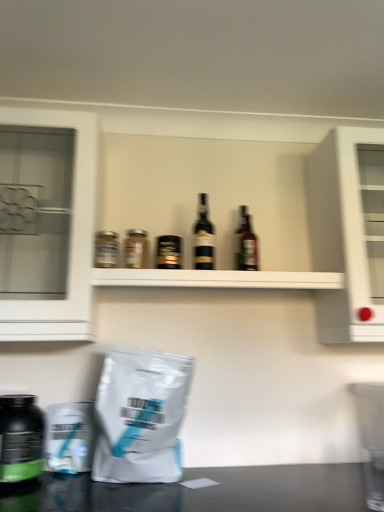
Where is `white glossy cabinet at upper right, which is the first cabinetry in right-to-left order`? This screenshot has height=512, width=384. white glossy cabinet at upper right, which is the first cabinetry in right-to-left order is located at coordinates (348, 232).

What do you see at coordinates (203, 238) in the screenshot? I see `black glass bottle at center, acting as the 5th bottle starting from the left` at bounding box center [203, 238].

In order to click on white matte grocery bag at lower left in this screenshot , I will do `click(141, 416)`.

From the image's perspective, is green matte bottle at lower left, positioned as the first bottle in left-to-right order, below metallic silver jar at upper left, positioned as the second bottle in left-to-right order?

Yes, from the image's perspective, green matte bottle at lower left, positioned as the first bottle in left-to-right order, is beneath metallic silver jar at upper left, positioned as the second bottle in left-to-right order.

Is green matte bottle at lower left, which is counted as the 6th bottle, starting from the right, not near metallic silver jar at upper left, the fifth bottle when ordered from right to left?

No, green matte bottle at lower left, which is counted as the 6th bottle, starting from the right, is not far from metallic silver jar at upper left, the fifth bottle when ordered from right to left.

Which object is thinner, green matte bottle at lower left, which is counted as the 6th bottle, starting from the right, or metallic silver jar at upper left, the fifth bottle when ordered from right to left?

With smaller width is metallic silver jar at upper left, the fifth bottle when ordered from right to left.

From the picture: Is green matte bottle at lower left, positioned as the first bottle in left-to-right order, inside or outside of metallic silver jar at upper left, positioned as the second bottle in left-to-right order?

green matte bottle at lower left, positioned as the first bottle in left-to-right order, is located beyond the bounds of metallic silver jar at upper left, positioned as the second bottle in left-to-right order.

Is white glossy shelf at center wider or thinner than white glass cabinet at left, which appears as the first cabinetry when viewed from the left?

white glossy shelf at center is thinner than white glass cabinet at left, which appears as the first cabinetry when viewed from the left.

Based on the photo, is white glossy shelf at center aimed at white glass cabinet at left, which is counted as the 2th cabinetry, starting from the right?

No, white glossy shelf at center is not oriented towards white glass cabinet at left, which is counted as the 2th cabinetry, starting from the right.

Is white glossy shelf at center at the right side of white glass cabinet at left, which is counted as the 2th cabinetry, starting from the right?

Indeed, white glossy shelf at center is positioned on the right side of white glass cabinet at left, which is counted as the 2th cabinetry, starting from the right.

From the image's perspective, is white glass cabinet at left, which appears as the first cabinetry when viewed from the left, on top of green matte bottle at lower left, positioned as the first bottle in left-to-right order?

Yes, from the image's perspective, white glass cabinet at left, which appears as the first cabinetry when viewed from the left, is above green matte bottle at lower left, positioned as the first bottle in left-to-right order.

Is white glass cabinet at left, which is counted as the 2th cabinetry, starting from the right, wider or thinner than green matte bottle at lower left, which is counted as the 6th bottle, starting from the right?

Considering their sizes, white glass cabinet at left, which is counted as the 2th cabinetry, starting from the right, looks broader than green matte bottle at lower left, which is counted as the 6th bottle, starting from the right.

From a real-world perspective, which object stands above the other?

white glass cabinet at left, which is counted as the 2th cabinetry, starting from the right, from a real-world perspective.

Visually, is white glass cabinet at left, which is counted as the 2th cabinetry, starting from the right, positioned to the left or to the right of green matte bottle at lower left, which is counted as the 6th bottle, starting from the right?

From the image, it's evident that white glass cabinet at left, which is counted as the 2th cabinetry, starting from the right, is to the right of green matte bottle at lower left, which is counted as the 6th bottle, starting from the right.

How different are the orientations of black matte bottle at center, placed as the third bottle when sorted from right to left, and green matte bottle at lower left, positioned as the first bottle in left-to-right order, in degrees?

There is a 0.284-degree angle between the facing directions of black matte bottle at center, placed as the third bottle when sorted from right to left, and green matte bottle at lower left, positioned as the first bottle in left-to-right order.

Based on the photo, would you say black matte bottle at center, placed as the third bottle when sorted from right to left, is to the left or to the right of green matte bottle at lower left, positioned as the first bottle in left-to-right order, in the picture?

black matte bottle at center, placed as the third bottle when sorted from right to left, is positioned on green matte bottle at lower left, positioned as the first bottle in left-to-right order,'s right side.

Is black matte bottle at center, placed as the third bottle when sorted from right to left, thinner than green matte bottle at lower left, positioned as the first bottle in left-to-right order?

Indeed, black matte bottle at center, placed as the third bottle when sorted from right to left, has a lesser width compared to green matte bottle at lower left, positioned as the first bottle in left-to-right order.

Is black matte bottle at center, which is counted as the 4th bottle, starting from the left, positioned far away from green matte bottle at lower left, positioned as the first bottle in left-to-right order?

Actually, black matte bottle at center, which is counted as the 4th bottle, starting from the left, and green matte bottle at lower left, positioned as the first bottle in left-to-right order, are a little close together.

Does point (127, 263) come closer to viewer compared to point (254, 245)?

Yes.

From a real-world perspective, is matte glass jar at center, which is the 3th bottle from left to right, above or below brown glass bottle at center, which appears as the 1th bottle when viewed from the right?

→ matte glass jar at center, which is the 3th bottle from left to right, is situated lower than brown glass bottle at center, which appears as the 1th bottle when viewed from the right, in the real world.

Is matte glass jar at center, which is the 3th bottle from left to right, shorter than brown glass bottle at center, which appears as the 1th bottle when viewed from the right?

Indeed, matte glass jar at center, which is the 3th bottle from left to right, has a lesser height compared to brown glass bottle at center, which appears as the 1th bottle when viewed from the right.

In terms of height, does metallic silver jar at upper left, positioned as the second bottle in left-to-right order, look taller or shorter compared to black matte bottle at center, which is counted as the 4th bottle, starting from the left?

Considering their sizes, metallic silver jar at upper left, positioned as the second bottle in left-to-right order, has less height than black matte bottle at center, which is counted as the 4th bottle, starting from the left.

Is point (116, 266) positioned after point (178, 237)?

No, (116, 266) is in front of (178, 237).

From a real-world perspective, which object rests below the other?

metallic silver jar at upper left, positioned as the second bottle in left-to-right order, is physically lower.

Is metallic silver jar at upper left, positioned as the second bottle in left-to-right order, in front of black matte bottle at center, placed as the third bottle when sorted from right to left?

That is True.

In the scene shown: Which object is positioned more to the left, white glossy cabinet at upper right, the second cabinetry when ordered from left to right, or green matte bottle at lower left, which is counted as the 6th bottle, starting from the right?

From the viewer's perspective, green matte bottle at lower left, which is counted as the 6th bottle, starting from the right, appears more on the left side.

From the image's perspective, count 4th bottles downward from the white glossy cabinet at upper right, which is the first cabinetry in right-to-left order, and point to it. Please provide its 2D coordinates.

[(20, 439)]

In terms of size, does white glossy cabinet at upper right, which is the first cabinetry in right-to-left order, appear bigger or smaller than green matte bottle at lower left, positioned as the first bottle in left-to-right order?

Clearly, white glossy cabinet at upper right, which is the first cabinetry in right-to-left order, is larger in size than green matte bottle at lower left, positioned as the first bottle in left-to-right order.

Is white glossy cabinet at upper right, which is the first cabinetry in right-to-left order, turned away from green matte bottle at lower left, which is counted as the 6th bottle, starting from the right?

No, green matte bottle at lower left, which is counted as the 6th bottle, starting from the right, is not at the back of white glossy cabinet at upper right, which is the first cabinetry in right-to-left order.

Where is `bottle that appears below the metallic silver jar at upper left, positioned as the second bottle in left-to-right order (from a real-world perspective)`? The width and height of the screenshot is (384, 512). bottle that appears below the metallic silver jar at upper left, positioned as the second bottle in left-to-right order (from a real-world perspective) is located at coordinates (20, 439).

The image size is (384, 512). Identify the location of cabinetry lying on the left of white glossy shelf at center. (70, 240).

Looking at the image, which one is located closer to white glass cabinet at left, which is counted as the 2th cabinetry, starting from the right, black matte bottle at center, which is counted as the 4th bottle, starting from the left, or matte glass jar at center, which is the fourth bottle in right-to-left order?

matte glass jar at center, which is the fourth bottle in right-to-left order, is positioned closer to the anchor white glass cabinet at left, which is counted as the 2th cabinetry, starting from the right.

Looking at the image, which one is located closer to black glass bottle at center, acting as the 5th bottle starting from the left, metallic silver jar at upper left, the fifth bottle when ordered from right to left, or white matte grocery bag at lower left?

metallic silver jar at upper left, the fifth bottle when ordered from right to left, lies closer to black glass bottle at center, acting as the 5th bottle starting from the left, than the other object.

Which object lies nearer to the anchor point white glossy cabinet at upper right, the second cabinetry when ordered from left to right, white glass cabinet at left, which is counted as the 2th cabinetry, starting from the right, or black matte bottle at center, which is counted as the 4th bottle, starting from the left?

black matte bottle at center, which is counted as the 4th bottle, starting from the left, is closer to white glossy cabinet at upper right, the second cabinetry when ordered from left to right.

Looking at the image, which one is located closer to white glossy shelf at center, white matte grocery bag at lower left or brown glass bottle at center, which appears as the 1th bottle when viewed from the right?

brown glass bottle at center, which appears as the 1th bottle when viewed from the right, lies closer to white glossy shelf at center than the other object.

Looking at the image, which one is located further to brown glass bottle at center, which appears as the 1th bottle when viewed from the right, green matte bottle at lower left, which is counted as the 6th bottle, starting from the right, or matte glass jar at center, which is the fourth bottle in right-to-left order?

green matte bottle at lower left, which is counted as the 6th bottle, starting from the right, is positioned further to the anchor brown glass bottle at center, which appears as the 1th bottle when viewed from the right.

In the scene shown: Based on their spatial positions, is black glass bottle at center, acting as the 5th bottle starting from the left, or green matte bottle at lower left, positioned as the first bottle in left-to-right order, further from white glass cabinet at left, which appears as the first cabinetry when viewed from the left?

black glass bottle at center, acting as the 5th bottle starting from the left, is positioned further to the anchor white glass cabinet at left, which appears as the first cabinetry when viewed from the left.

Estimate the real-world distances between objects in this image. Which object is closer to matte glass jar at center, which is the 3th bottle from left to right, black matte bottle at center, placed as the third bottle when sorted from right to left, or white glossy shelf at center?

black matte bottle at center, placed as the third bottle when sorted from right to left, lies closer to matte glass jar at center, which is the 3th bottle from left to right, than the other object.

From the image, which object appears to be farther from brown glass bottle at center, which appears as the sixth bottle when viewed from the left, white glass cabinet at left, which is counted as the 2th cabinetry, starting from the right, or black glass bottle at center, the 2th bottle when ordered from right to left?

Based on the image, white glass cabinet at left, which is counted as the 2th cabinetry, starting from the right, appears to be further to brown glass bottle at center, which appears as the sixth bottle when viewed from the left.

The height and width of the screenshot is (512, 384). I want to click on bottle between black glass bottle at center, the 2th bottle when ordered from right to left, and white glossy cabinet at upper right, the second cabinetry when ordered from left to right, in the horizontal direction, so click(246, 244).

Identify the location of grocery bag between green matte bottle at lower left, which is counted as the 6th bottle, starting from the right, and white glossy cabinet at upper right, the second cabinetry when ordered from left to right. (141, 416).

This screenshot has height=512, width=384. I want to click on shelf situated between metallic silver jar at upper left, the fifth bottle when ordered from right to left, and white glossy cabinet at upper right, which is the first cabinetry in right-to-left order, from left to right, so click(216, 279).

The width and height of the screenshot is (384, 512). In order to click on grocery bag between white glass cabinet at left, which appears as the first cabinetry when viewed from the left, and brown glass bottle at center, which appears as the sixth bottle when viewed from the left, from left to right in this screenshot , I will do `click(141, 416)`.